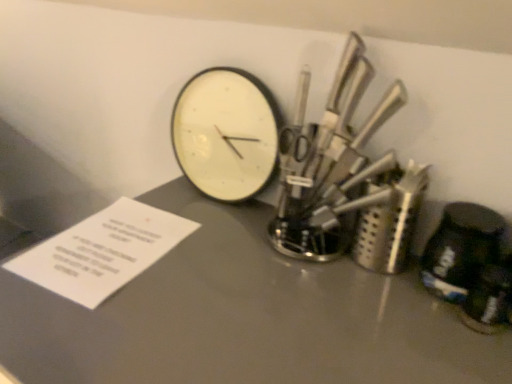
Question: From a real-world perspective, is polished metal knife set at upper right positioned above or below white paper at lower left?

Choices:
 (A) above
 (B) below

Answer: (A)

Question: Is polished metal knife set at upper right inside or outside of white paper at lower left?

Choices:
 (A) outside
 (B) inside

Answer: (A)

Question: Estimate the real-world distances between objects in this image. Which object is farther from the matte gray table at center?

Choices:
 (A) white matte wall clock at center
 (B) polished metal knife set at upper right
 (C) white paper at lower left

Answer: (A)

Question: Estimate the real-world distances between objects in this image. Which object is farther from the white matte wall clock at center?

Choices:
 (A) white paper at lower left
 (B) matte gray table at center
 (C) polished metal knife set at upper right

Answer: (A)